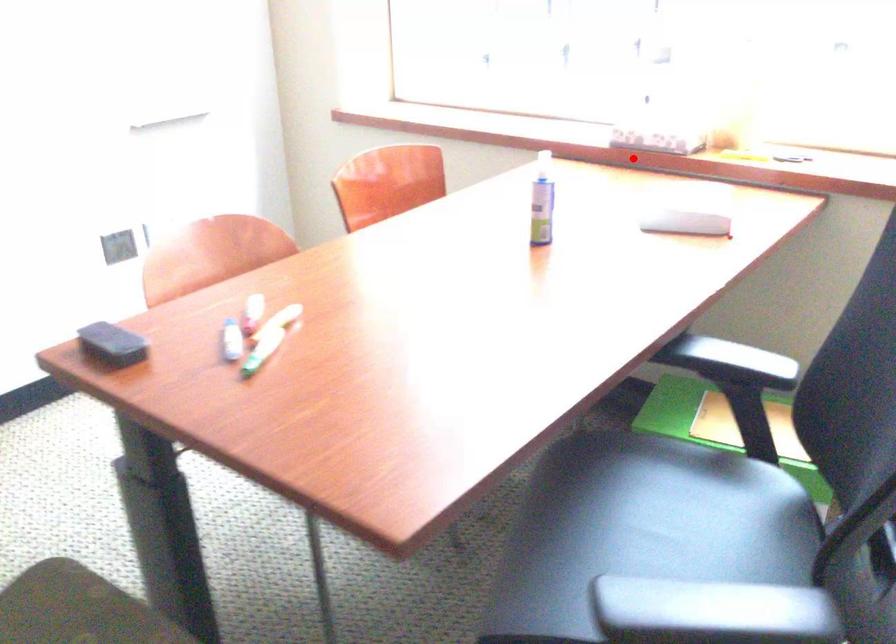
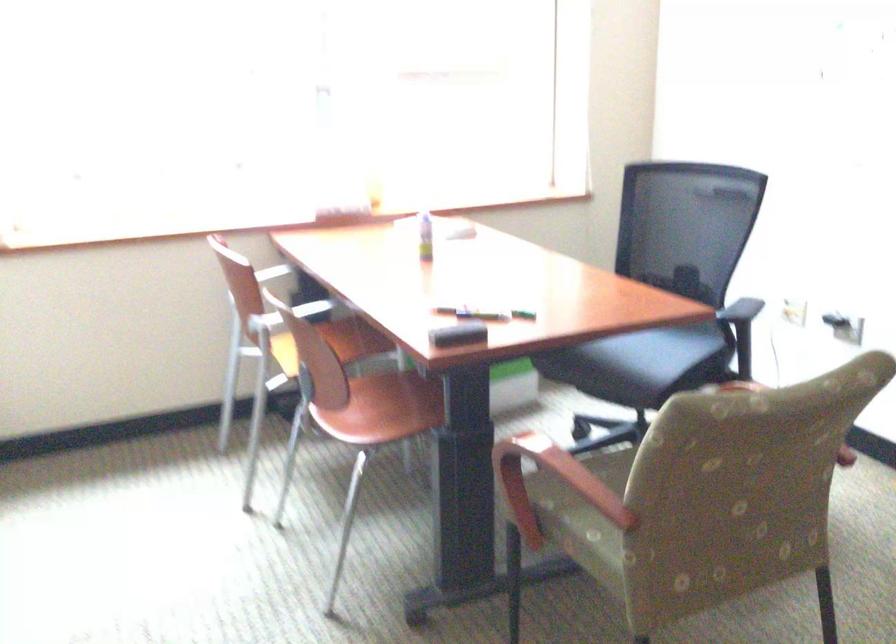
The point at the highlighted location is marked in the first image. Where is the corresponding point in the second image?

(346, 214)